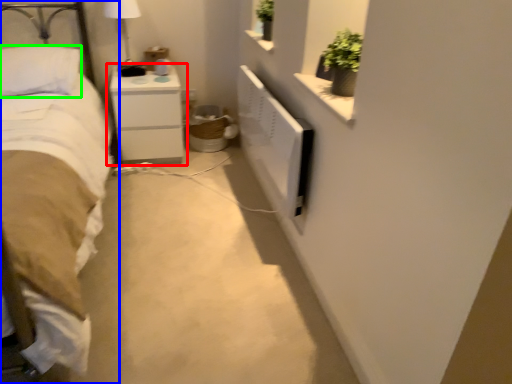
Question: Which is farther away from nightstand (highlighted by a red box)? bed (highlighted by a blue box) or pillow (highlighted by a green box)?

Choices:
 (A) bed
 (B) pillow

Answer: (A)